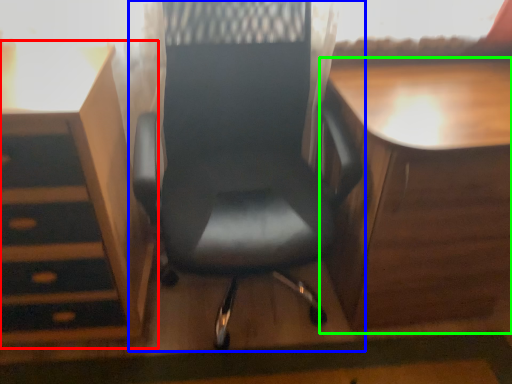
Question: Which object is the closest to the vanity (highlighted by a red box)? Choose among these: chair (highlighted by a blue box) or table (highlighted by a green box).

Choices:
 (A) chair
 (B) table

Answer: (A)